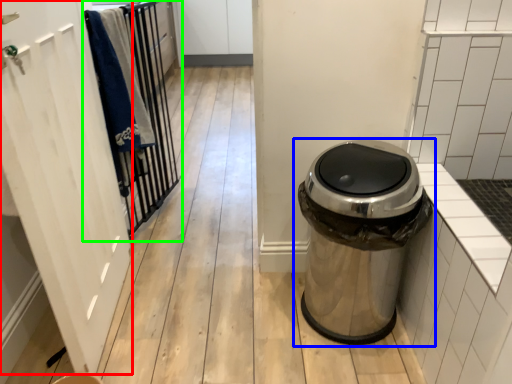
Question: Based on their relative distances, which object is farther from screen door (highlighted by a red box)? Choose from waste container (highlighted by a blue box) and closet (highlighted by a green box).

Choices:
 (A) waste container
 (B) closet

Answer: (A)